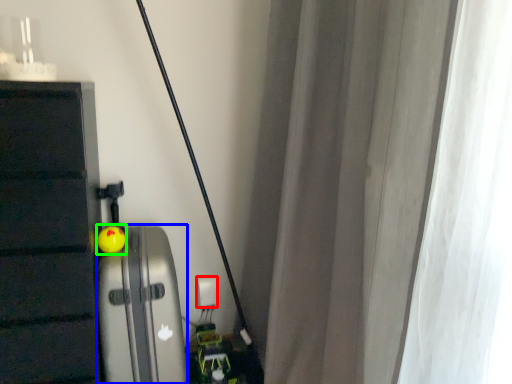
Question: Which object is the closest to the electric outlet (highlighted by a red box)? Choose among these: appliance (highlighted by a blue box) or toy (highlighted by a green box).

Choices:
 (A) appliance
 (B) toy

Answer: (A)